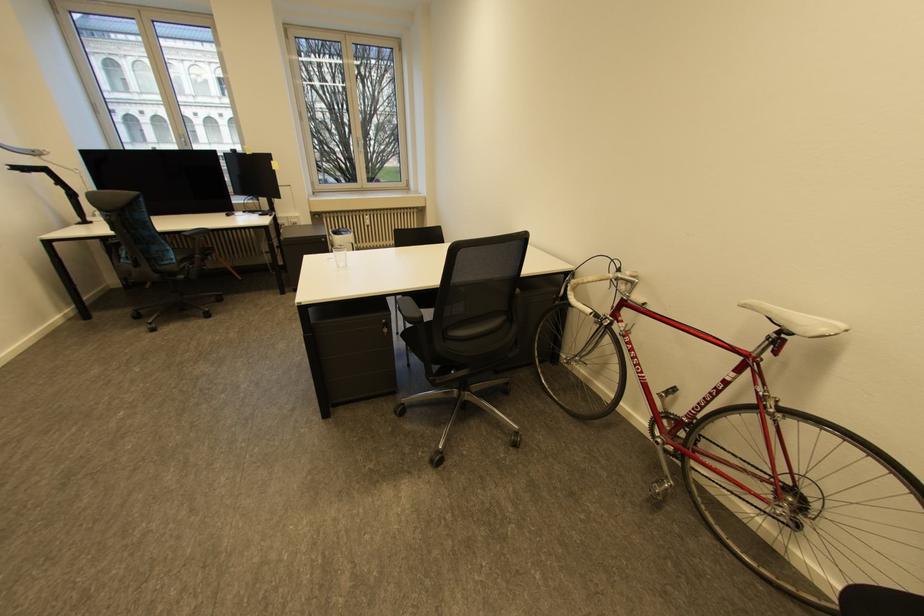
Find where to resting arm the black chair armrest. Please return your answer as a coordinate pair (x, y).

(408, 310)